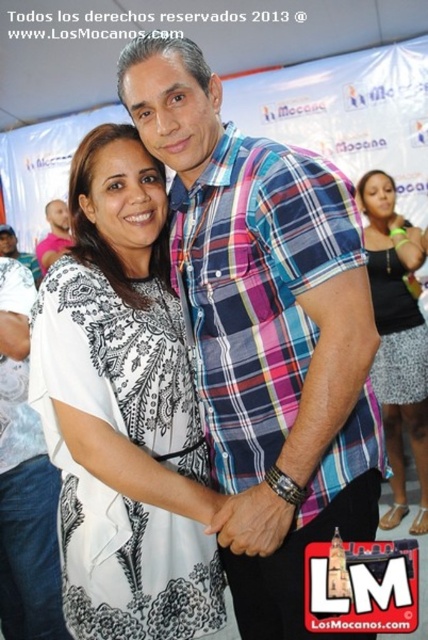
What is located at the coordinates point (265, 332)?

The plaid cotton shirt at center is located at point (265, 332).

In the scene shown: You are a photographer standing at the event and want to take a closeup shot of the white printed blouse at center. Your camera has a minimum focusing distance of 1 meter. Can you take the photo without moving closer?

The white printed blouse at center is 1.09 meters away from the viewer. Since the camera requires at least 1 meter to focus, you can take the photo without moving closer.